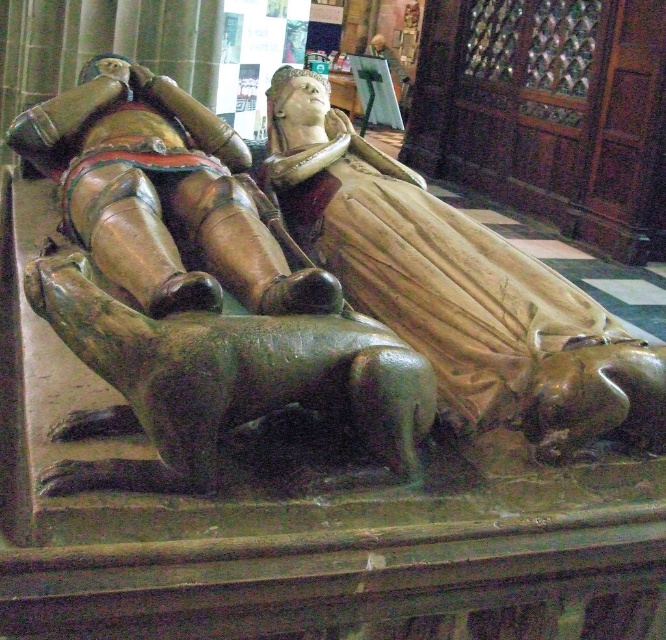
You are standing in the cathedral facing the stone sarcophagus. You want to place a bouquet of flowers at the base of the sarcophagus. The bouquet requires a space that is at least 30 feet away from where you are standing. Is the point marked at coordinates point (354,195) on the sarcophagus suitable for placing the bouquet?

The point marked at coordinates point (354,195) on the sarcophagus is 31.60 feet away from the camera, which is more than the required 30 feet, so it is suitable for placing the bouquet.

You are an art conservator examining the stone sarcophagus in the cathedral. You need to clean both the matte gold statue at center and the polished bronze knight at center. Which object should you start with if you want to clean the one closer to you first?

The matte gold statue at center is further to the viewer than the polished bronze knight at center, so you should start with the matte gold statue at center since it is closer to you.

You are standing in front of the stone sarcophagus in the cathedral. There are two points marked on the sarcophagus. The first point is at coordinates point (605,394) and the second is at point (85,205). Which point is nearer to you?

Point (605,394) is closer to the viewer than point (85,205).